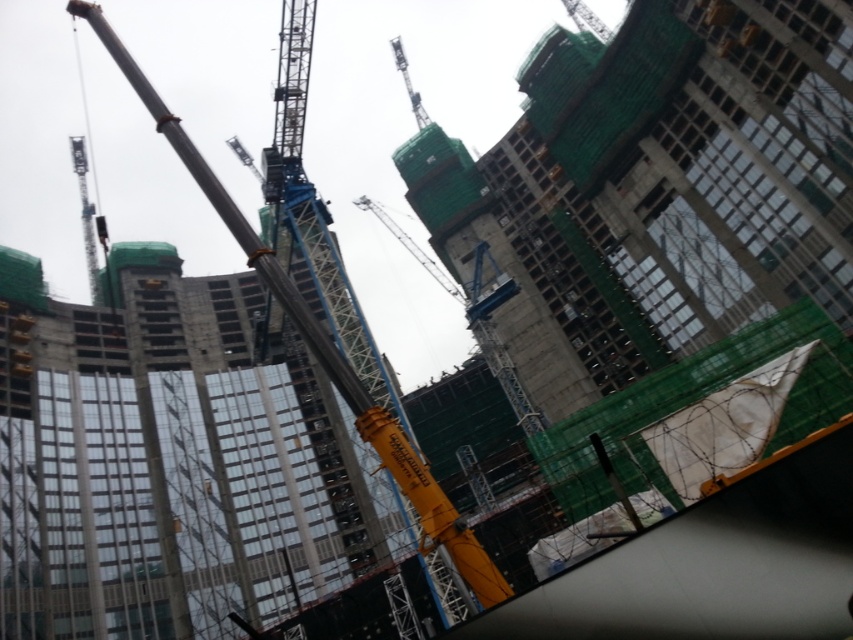
Question: Which point is closer to the camera taking this photo?

Choices:
 (A) (791, 32)
 (B) (161, 323)
 (C) (202, 177)

Answer: (C)

Question: Can you confirm if concrete construction at center is wider than concrete construction crane at center?

Choices:
 (A) yes
 (B) no

Answer: (B)

Question: Is concrete construction at center wider than yellow metallic crane at center?

Choices:
 (A) yes
 (B) no

Answer: (A)

Question: Among these objects, which one is farthest from the camera?

Choices:
 (A) yellow metallic crane at center
 (B) concrete construction crane at center
 (C) concrete construction at center

Answer: (B)

Question: Can you confirm if concrete construction at center is positioned above yellow metallic crane at center?

Choices:
 (A) yes
 (B) no

Answer: (A)

Question: Which of these objects is positioned closest to the concrete construction at center?

Choices:
 (A) yellow metallic crane at center
 (B) concrete construction crane at center

Answer: (B)